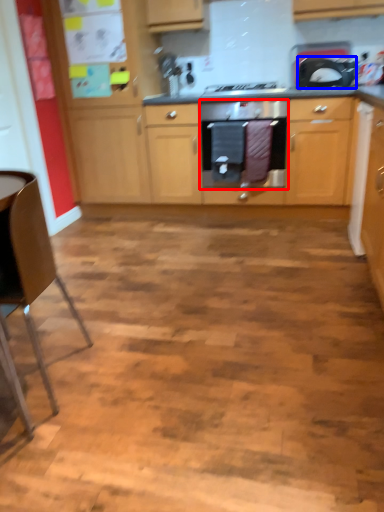
Question: Which of the following is the farthest to the observer, home appliance (highlighted by a red box) or kitchen appliance (highlighted by a blue box)?

Choices:
 (A) home appliance
 (B) kitchen appliance

Answer: (A)